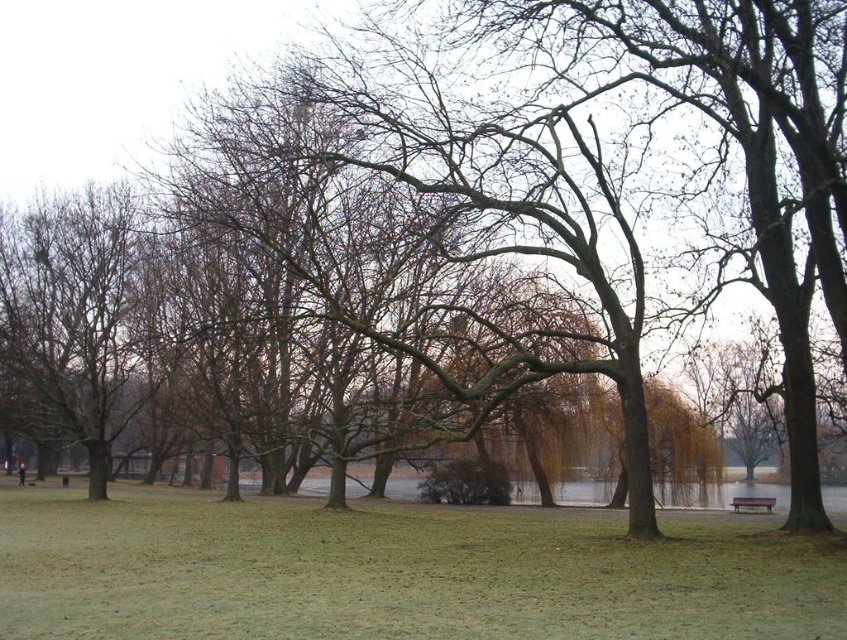
Is the position of green grassy at center more distant than that of wooden bench at lower right?

No, green grassy at center is closer to the viewer.

What do you see at coordinates (399, 572) in the screenshot?
I see `green grassy at center` at bounding box center [399, 572].

At what (x,y) coordinates should I click in order to perform the action: click on green grassy at center. Please return your answer as a coordinate pair (x, y). The width and height of the screenshot is (847, 640). Looking at the image, I should click on [399, 572].